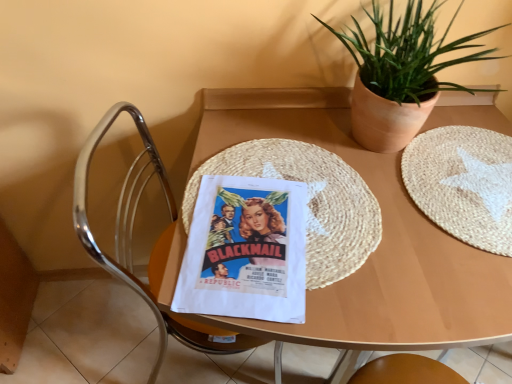
Locate an element on the screen. vacant space to the right of woven straw mat at center is located at coordinates (443, 210).